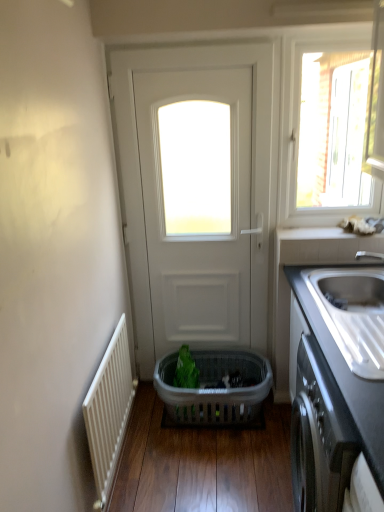
Identify the location of free space below white ribbed radiator at left (from a real-world perspective). This screenshot has height=512, width=384. (123, 461).